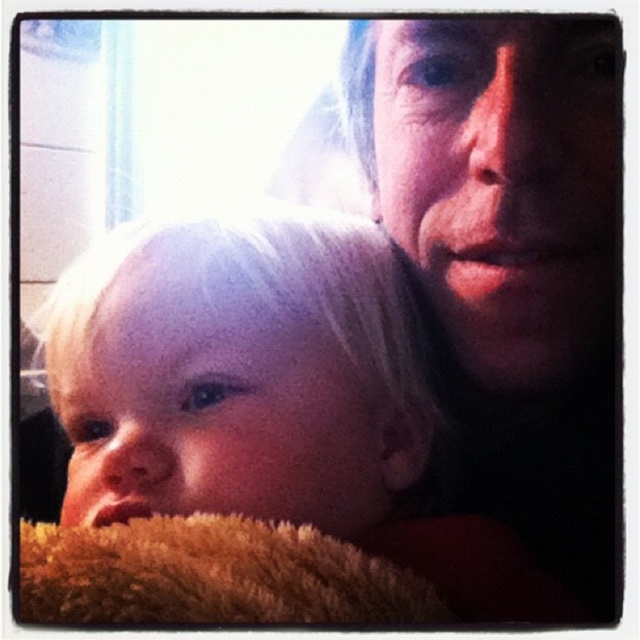
You are a photographer who wants to ensure both the blonde hair at center and the smooth skin face at upper right are clearly visible in a photo. The minimum focus distance for your camera is 4 inches. Can you focus on both objects without adjusting your camera position?

The distance between the blonde hair at center and the smooth skin face at upper right is 4.21 inches. Since the minimum focus distance is 4 inches, the camera can focus on both objects as the distance between them is slightly more than the minimum requirement.

In the scene shown: You are a photographer adjusting lighting for a portrait. You notice the blonde hair at center and the smooth skin face at upper right. Which object is closer to the light source based on their positions?

The blonde hair at center is closer to the light source because it is shorter than the smooth skin face at upper right, meaning it is positioned nearer to the light.

You are a photographer adjusting lighting for a portrait. You notice the blonde hair at center and the smooth skin face at upper right. Which object is positioned lower in the frame?

The blonde hair at center is positioned below the smooth skin face at upper right, so the blonde hair at center is lower in the frame.